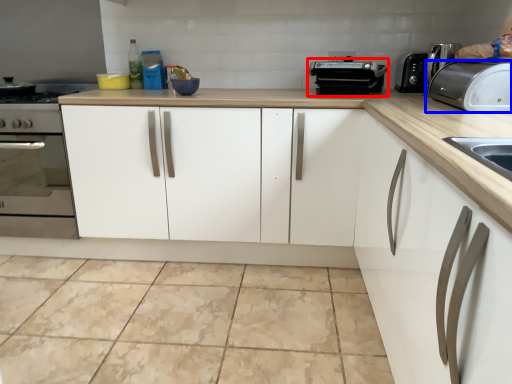
Question: Which object is further to the camera taking this photo, appliance (highlighted by a red box) or toaster (highlighted by a blue box)?

Choices:
 (A) appliance
 (B) toaster

Answer: (A)